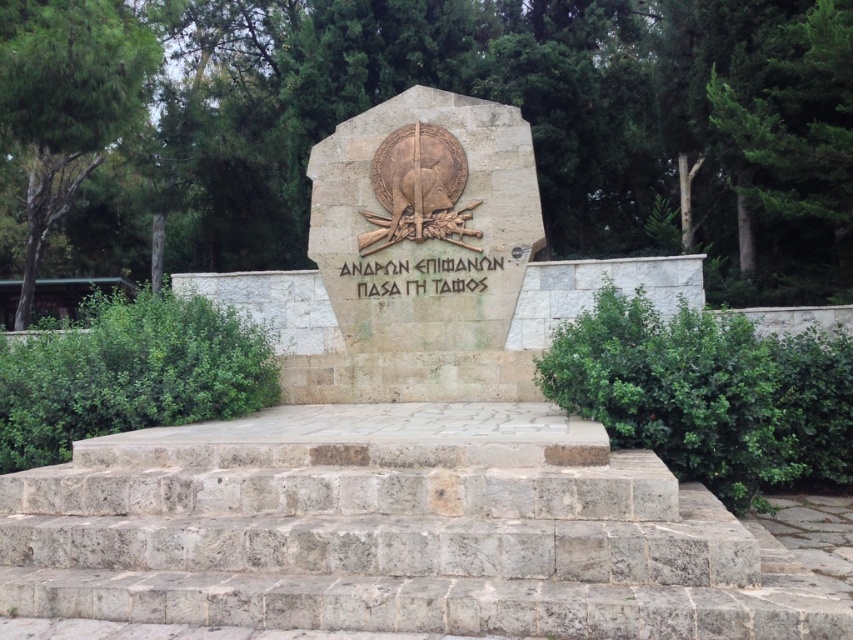
Is gray stone stairs at center positioned at the back of stone textured monument at center?

No, gray stone stairs at center is in front of stone textured monument at center.

Consider the image. Which of these two, gray stone stairs at center or stone textured monument at center, stands shorter?

gray stone stairs at center is shorter.

Based on the photo, measure the distance between point (28,536) and camera.

Point (28,536) and camera are 19.67 feet apart.

You are a GUI agent. You are given a task and a screenshot of the screen. Output one action in this format:
    pyautogui.click(x=<x>, y=<y>)
    Task: Click on the gray stone stairs at center
    The image size is (853, 640).
    Given the screenshot: What is the action you would take?
    pyautogui.click(x=403, y=552)